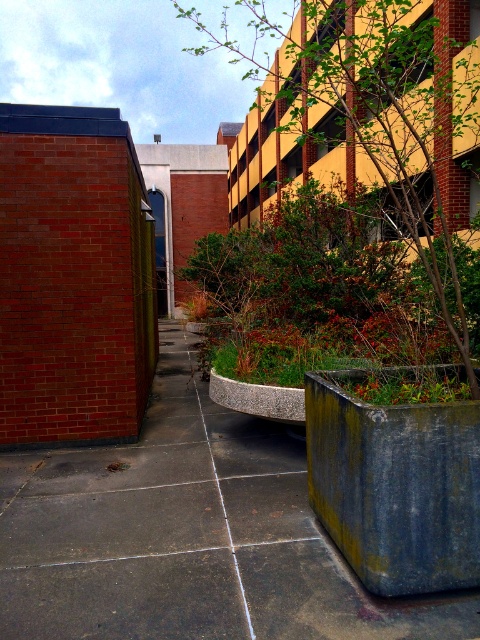
You are standing at the edge of the walkway and want to reach a bench located 12 feet away from you. Can you walk straight ahead on the concrete pavement at center to reach it?

The concrete pavement at center is only 11.12 feet away from you, so walking straight ahead on it won

Based on the scene description, what are the coordinates of the concrete pavement at center?

The coordinates of the concrete pavement at center are at point [189,536].